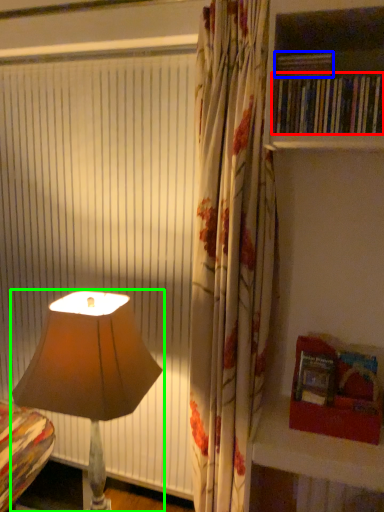
Question: Which is farther away from book (highlighted by a red box)? book (highlighted by a blue box) or lamp (highlighted by a green box)?

Choices:
 (A) book
 (B) lamp

Answer: (B)